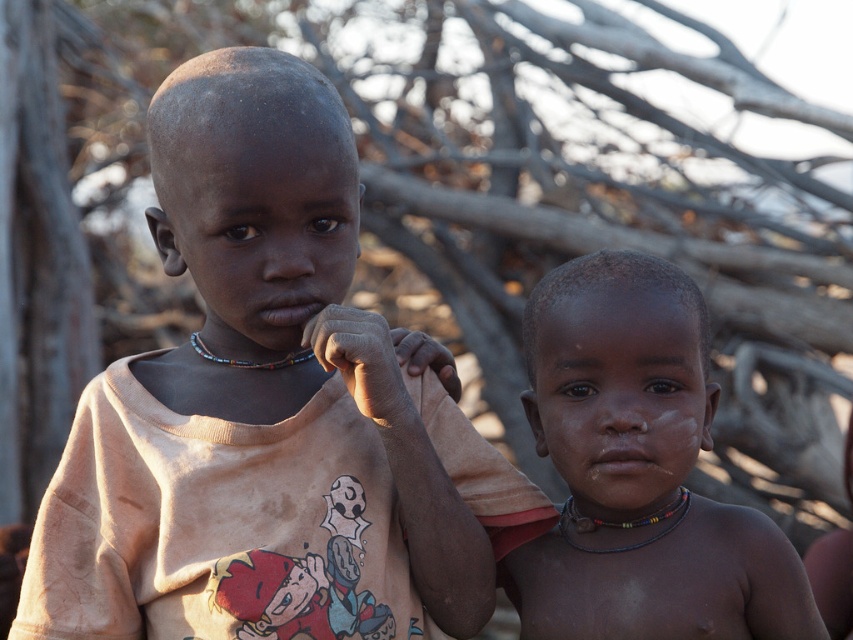
Is point (403, 433) more distant than point (665, 371)?

No, it is in front of (665, 371).

Who is positioned more to the left, matte orange t-shirt at left or matte skin child at center?

Positioned to the left is matte orange t-shirt at left.

Which is in front, point (346, 228) or point (622, 253)?

Point (346, 228)

This screenshot has width=853, height=640. I want to click on matte orange t-shirt at left, so click(x=268, y=412).